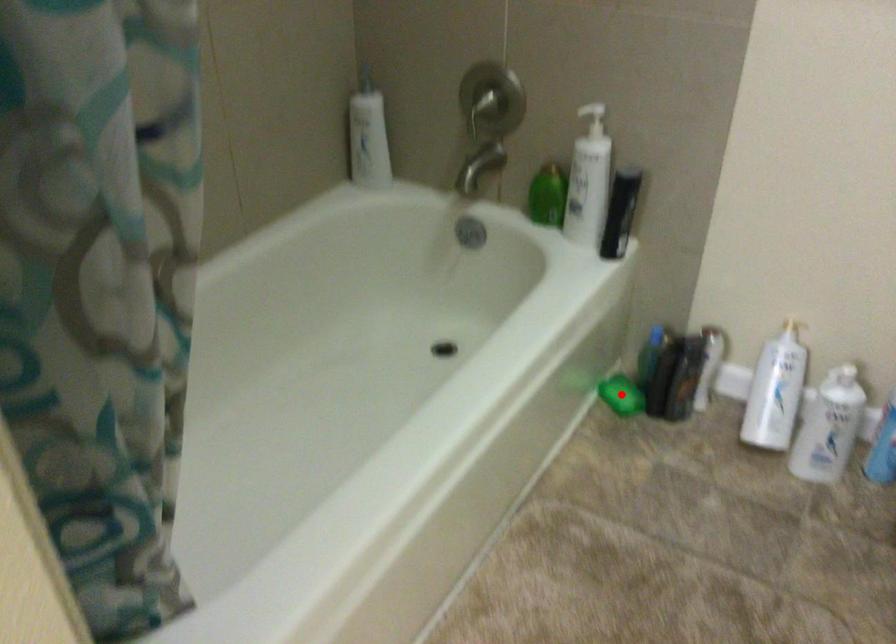
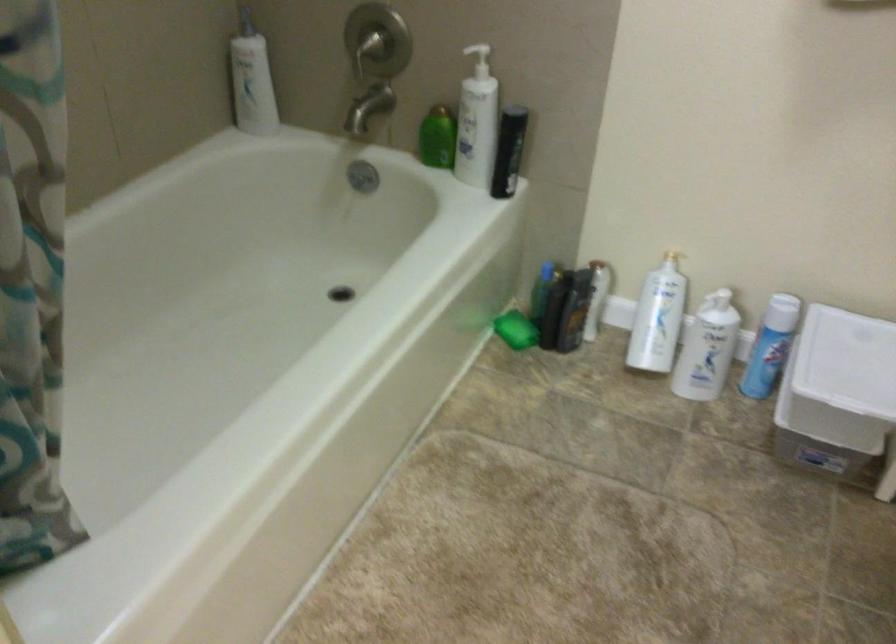
In the second image, find the point that corresponds to the highlighted location in the first image.

(515, 328)